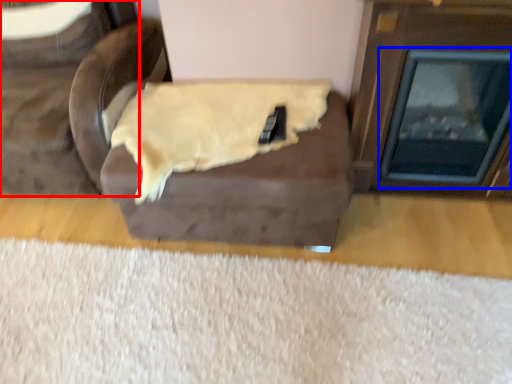
Question: Which object is further to the camera taking this photo, furniture (highlighted by a red box) or fireplace (highlighted by a blue box)?

Choices:
 (A) furniture
 (B) fireplace

Answer: (A)